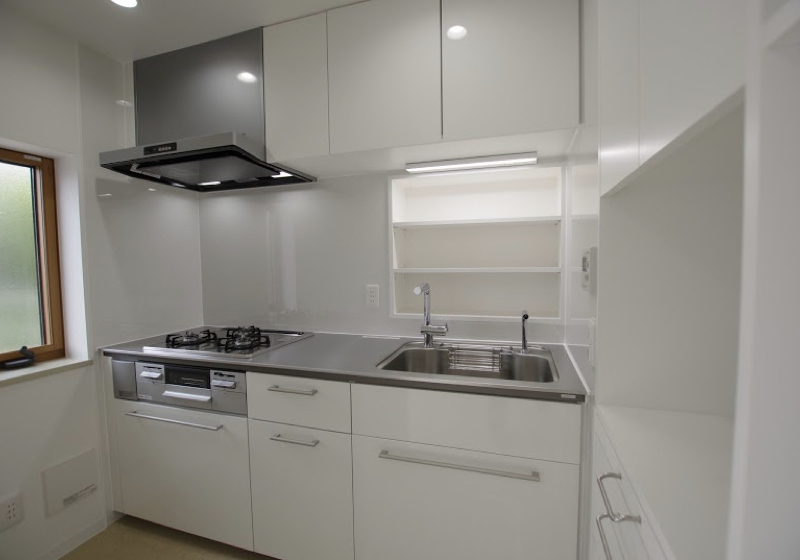
Locate an element on the screen. This screenshot has height=560, width=800. windowsill is located at coordinates (26, 375).